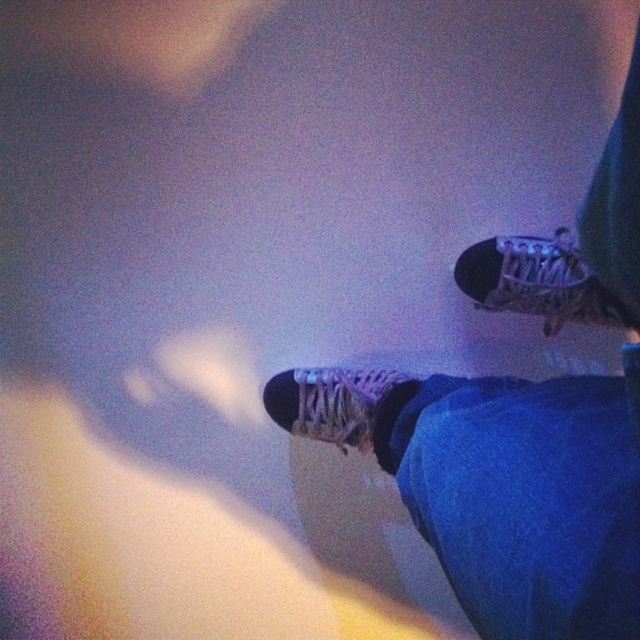
You are a photographer trying to capture the matte black skateboard at lower right and the matte white sneaker at center in a single frame. Given their sizes, which object should you position closer to the camera to ensure both appear roughly the same size in the photo?

Since the matte black skateboard at lower right is larger than the matte white sneaker at center, you should position the matte white sneaker at center closer to the camera. This way, the smaller sneaker will appear larger in the frame, balancing the sizes with the larger skateboard placed farther back.

You are standing at the point marked by the coordinates point (518, 428) in the image. Looking around, you see a pair of sneakers with purple patterns and blue jeans. What object is located at your current position?

The point (518, 428) indicates the location of the matte black skateboard at lower right.

You are a photographer trying to capture a closeup shot of both the matte black skateboard at lower right and the matte white sneaker at upper right. Given the current distance between them, can you fit both objects in your camera frame without moving either object?

The distance between the matte black skateboard at lower right and the matte white sneaker at upper right is 13.06 centimeters. Depending on your camera lens and zoom settings, it should be possible to capture both objects in the frame without moving them, as they are within a manageable distance apart.